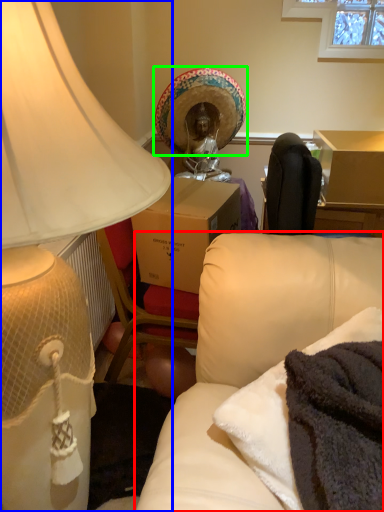
Question: Based on their relative distances, which object is nearer to studio couch (highlighted by a red box)? Choose from lamp (highlighted by a blue box) and headdress (highlighted by a green box).

Choices:
 (A) lamp
 (B) headdress

Answer: (A)